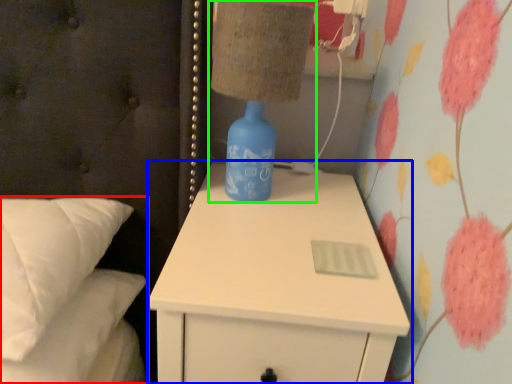
Question: Estimate the real-world distances between objects in this image. Which object is farther from bed (highlighted by a red box), nightstand (highlighted by a blue box) or table lamp (highlighted by a green box)?

Choices:
 (A) nightstand
 (B) table lamp

Answer: (B)